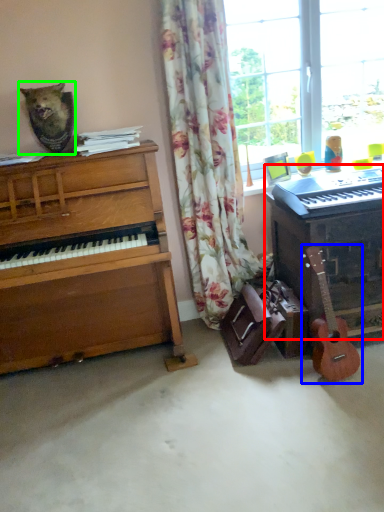
Question: Which object is positioned closest to piano (highlighted by a red box)? Select from guitar (highlighted by a blue box) and animal (highlighted by a green box).

Choices:
 (A) guitar
 (B) animal

Answer: (A)